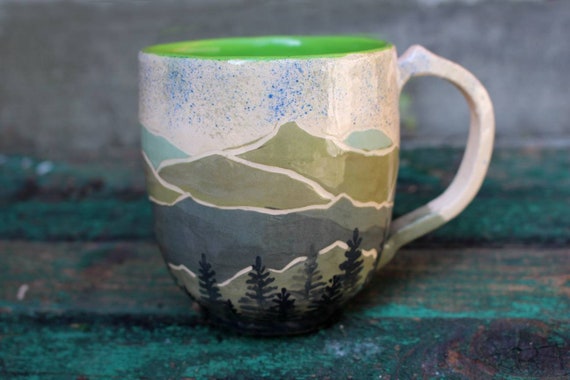
Identify the location of table. This screenshot has height=380, width=570. (457, 283).